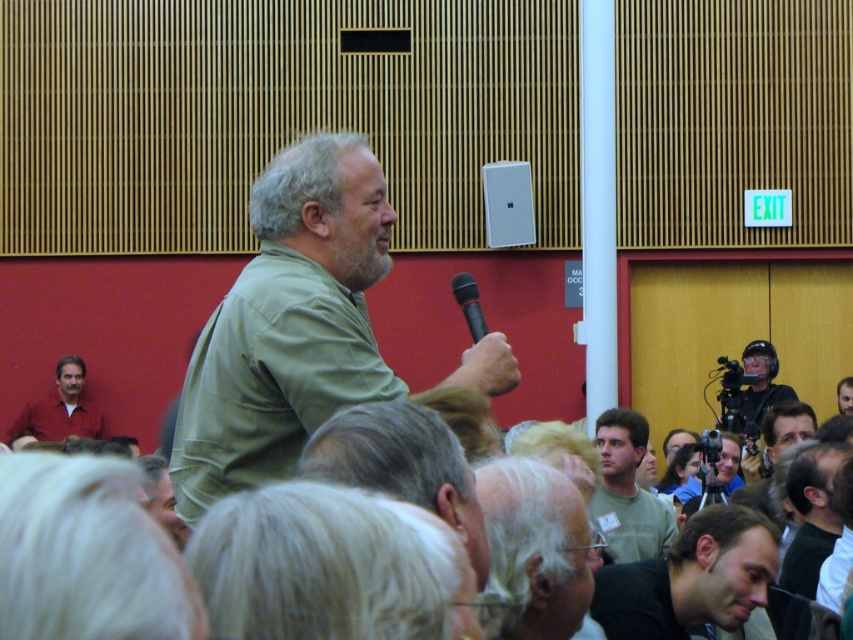
Question: Which object appears farthest from the camera in this image?

Choices:
 (A) green matte shirt at center
 (B) dark green shirt at lower right
 (C) green matte shirt at lower center
 (D) matte black camera at upper right

Answer: (D)

Question: Can you confirm if green matte shirt at center is wider than black plastic microphone at upper center?

Choices:
 (A) no
 (B) yes

Answer: (B)

Question: Can you confirm if white hair at center is bigger than matte black camera at upper right?

Choices:
 (A) yes
 (B) no

Answer: (A)

Question: Which of the following is the farthest from the observer?

Choices:
 (A) (473, 291)
 (B) (582, 552)
 (C) (442, 432)
 (D) (631, 548)

Answer: (D)

Question: Can you confirm if green matte shirt at center is positioned below black plastic microphone at upper center?

Choices:
 (A) no
 (B) yes

Answer: (B)

Question: Which object appears farthest from the camera in this image?

Choices:
 (A) dark green shirt at lower right
 (B) gray hair at center

Answer: (A)